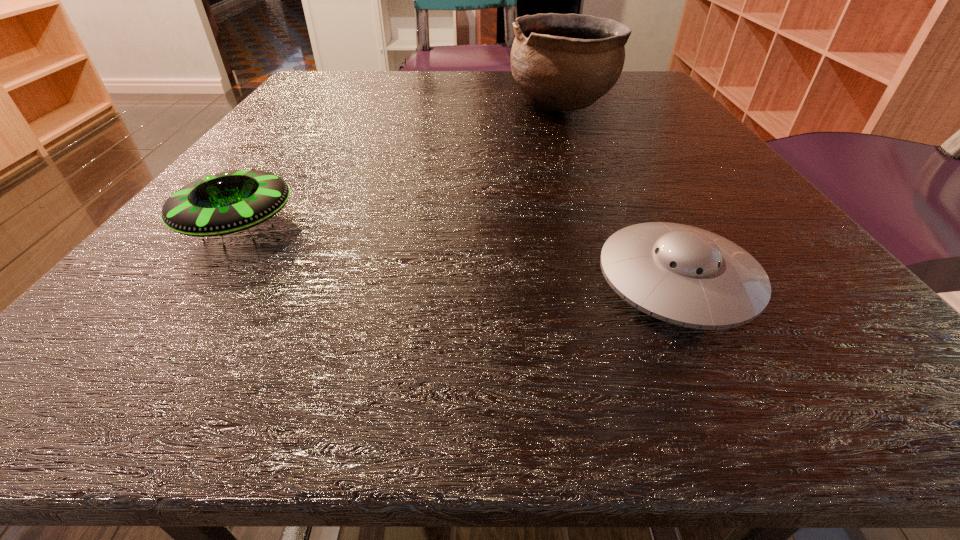
You are a GUI agent. You are given a task and a screenshot of the screen. Output one action in this format:
    pyautogui.click(x=<x>, y=<y>)
    Task: Click on the tallest object
    The image size is (960, 540).
    Given the screenshot: What is the action you would take?
    pyautogui.click(x=562, y=62)

Locate an element on the screen. The height and width of the screenshot is (540, 960). pottery is located at coordinates (562, 62).

The width and height of the screenshot is (960, 540). In order to click on the leftmost object in this screenshot , I will do `click(224, 201)`.

In order to click on the taller saucer in this screenshot , I will do `click(224, 201)`.

Identify the location of the right saucer. (684, 275).

This screenshot has height=540, width=960. Identify the location of the shorter saucer. (684, 275).

What are the coordinates of `vacant space located on the left of the farthest object` in the screenshot? It's located at (332, 104).

Locate an element on the screen. Image resolution: width=960 pixels, height=540 pixels. blank space located 0.210m on the right of the second shortest object is located at coordinates (456, 225).

You are a GUI agent. You are given a task and a screenshot of the screen. Output one action in this format:
    pyautogui.click(x=<x>, y=<y>)
    Task: Click on the vacant space located 0.060m on the right of the shorter saucer
    
    Given the screenshot: What is the action you would take?
    pyautogui.click(x=808, y=282)

Where is `object that is at the far edge`? Image resolution: width=960 pixels, height=540 pixels. object that is at the far edge is located at coordinates (562, 62).